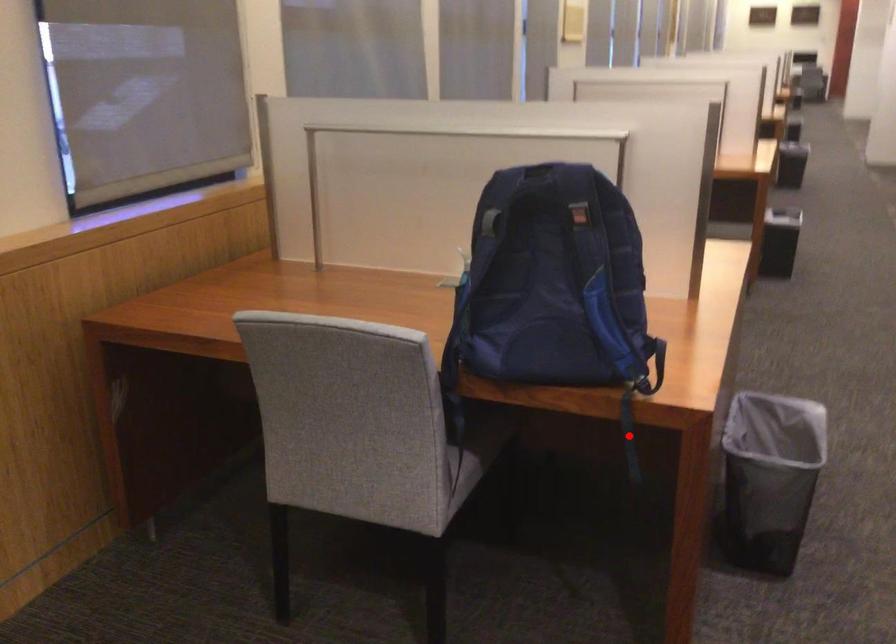
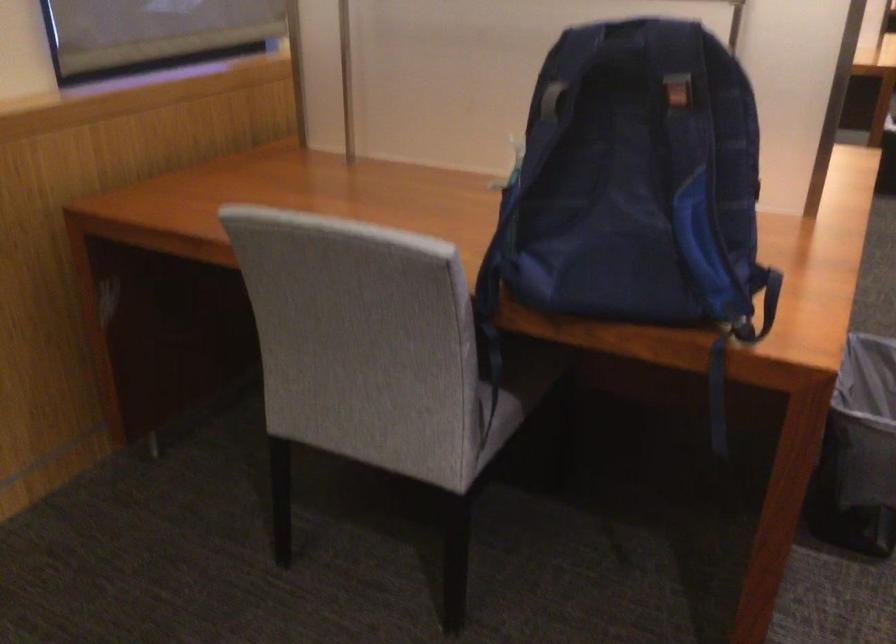
Question: I am providing you with two images of the same scene from different viewpoints. Image1 has a red point marked. In image2, the corresponding 3D location appears at what relative position? Reply with the corresponding letter.

Choices:
 (A) Closer
 (B) Farther

Answer: (A)